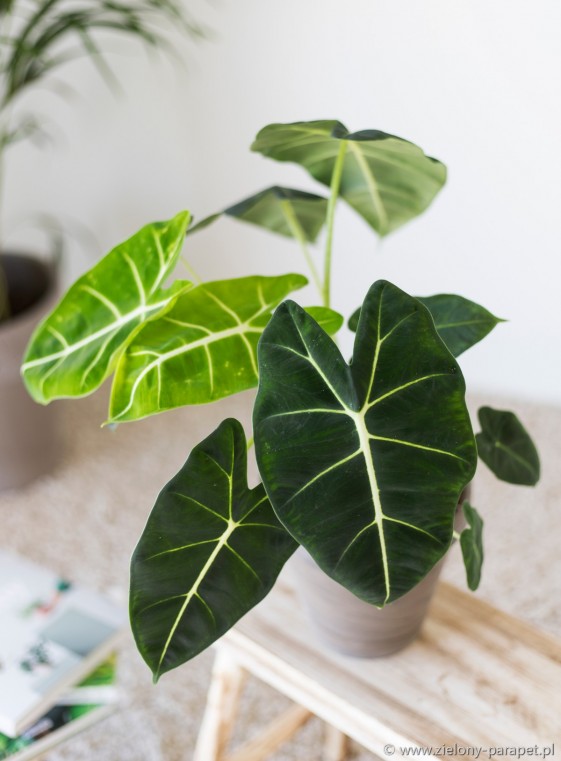
Locate an element on the screen. The width and height of the screenshot is (561, 761). the larger pot is located at coordinates (25, 432).